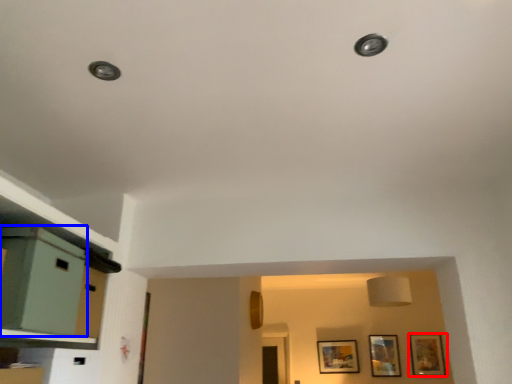
Question: Which of the following is the closest to the observer, picture frame (highlighted by a red box) or file cabinet (highlighted by a blue box)?

Choices:
 (A) picture frame
 (B) file cabinet

Answer: (B)